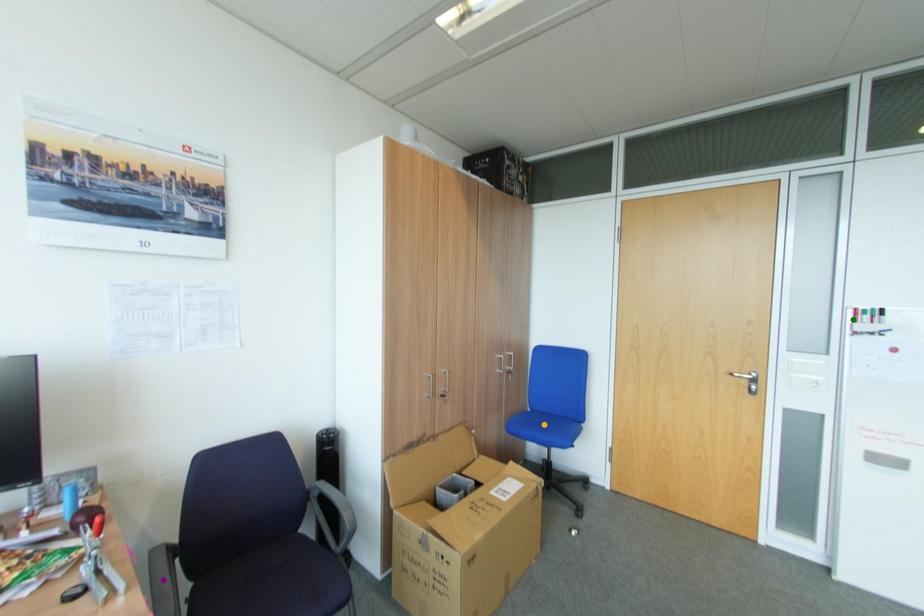
Consider the image. Order these from nearest to farthest:
orange point | purple point | green point

1. purple point
2. green point
3. orange point